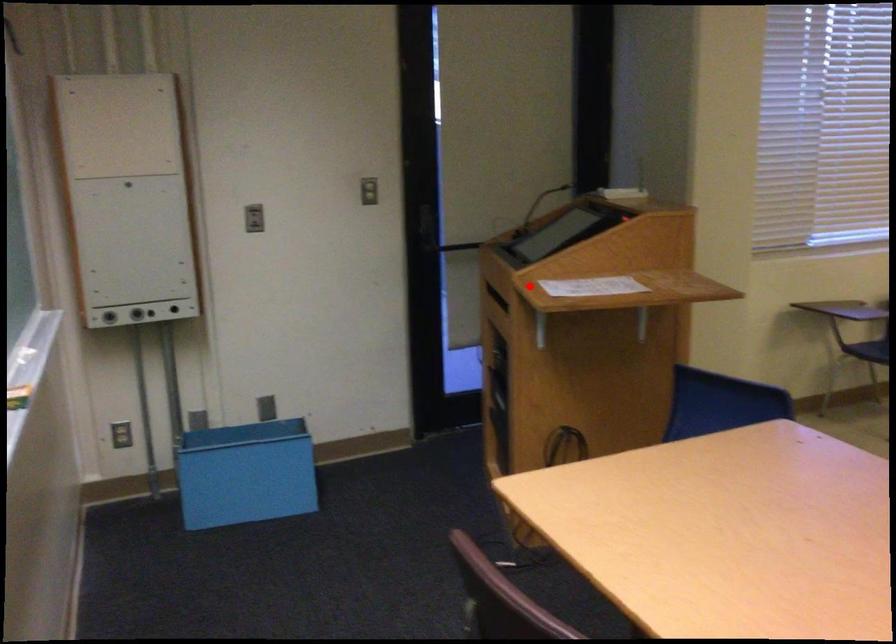
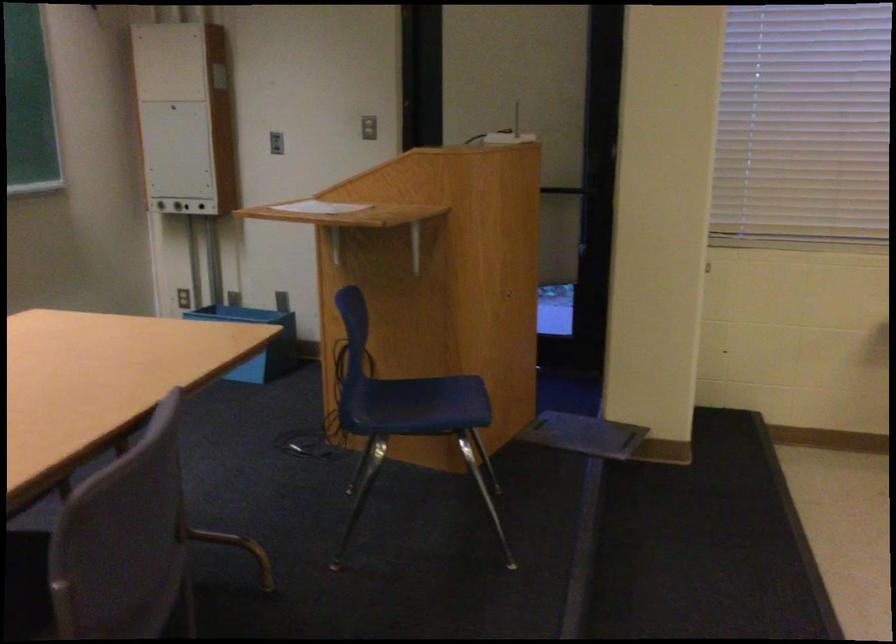
Where in the second image is the point corresponding to the highlighted location from the first image?

(320, 207)